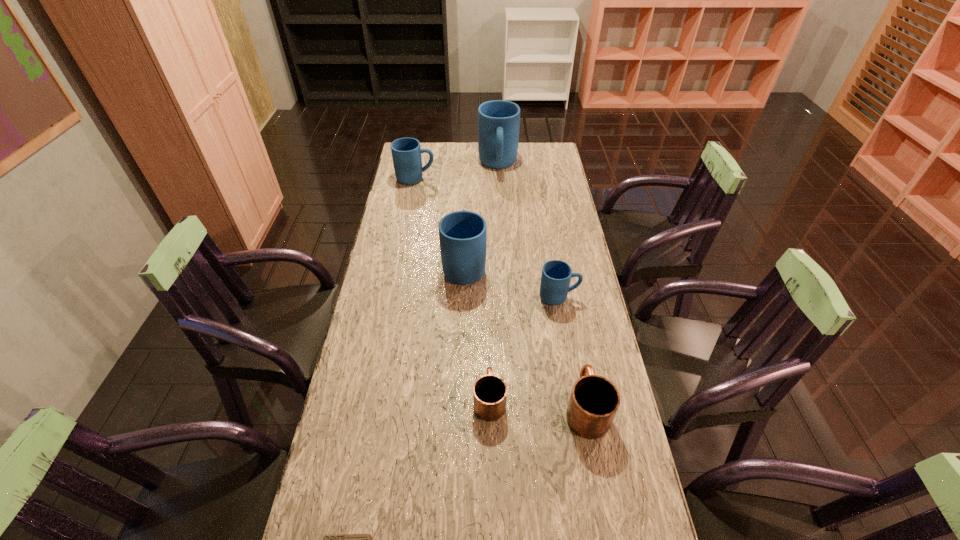
Identify the location of empty location between the sixth shortest object and the shortest mug. (477, 332).

The width and height of the screenshot is (960, 540). I want to click on unoccupied area between the leftmost mug and the smallest blue mug, so click(488, 238).

Identify the location of blank region between the leftmost blue mug and the bigger rust mug. This screenshot has width=960, height=540. (501, 293).

Select which object is the fourth closest to the shortest mug. Please provide its 2D coordinates. Your answer should be formatted as a tuple, i.e. [(x, y)], where the tuple contains the x and y coordinates of a point satisfying the conditions above.

[(462, 234)]

What are the coordinates of `object that ranks as the second closest to the bigger rust mug` in the screenshot? It's located at (556, 275).

Where is `mug that is the second closest to the smallest blue mug`? The width and height of the screenshot is (960, 540). mug that is the second closest to the smallest blue mug is located at coordinates click(594, 401).

Locate which mug ranks second in proximity to the right rust mug. Please provide its 2D coordinates. Your answer should be formatted as a tuple, i.e. [(x, y)], where the tuple contains the x and y coordinates of a point satisfying the conditions above.

[(556, 275)]

Identify the location of the closest blue mug to the smallest blue mug. (462, 234).

Identify which blue mug is the nearest to the smallest blue mug. Please provide its 2D coordinates. Your answer should be formatted as a tuple, i.e. [(x, y)], where the tuple contains the x and y coordinates of a point satisfying the conditions above.

[(462, 234)]

What are the coordinates of `vacant space that satisfies the following two spatial constraints: 1. on the side of the shortest mug with the handle; 2. on the side of the third biggest blue mug with the handle` in the screenshot? It's located at (486, 179).